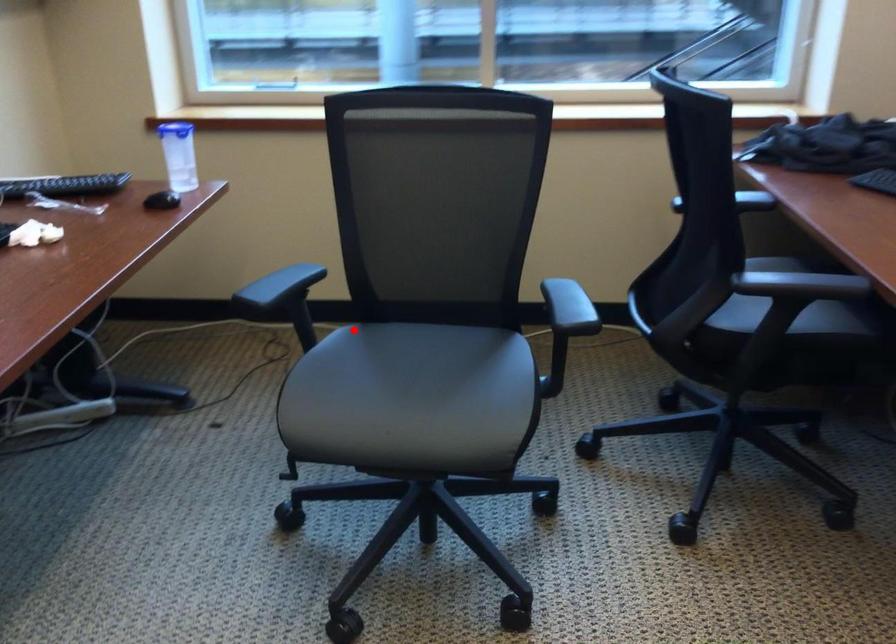
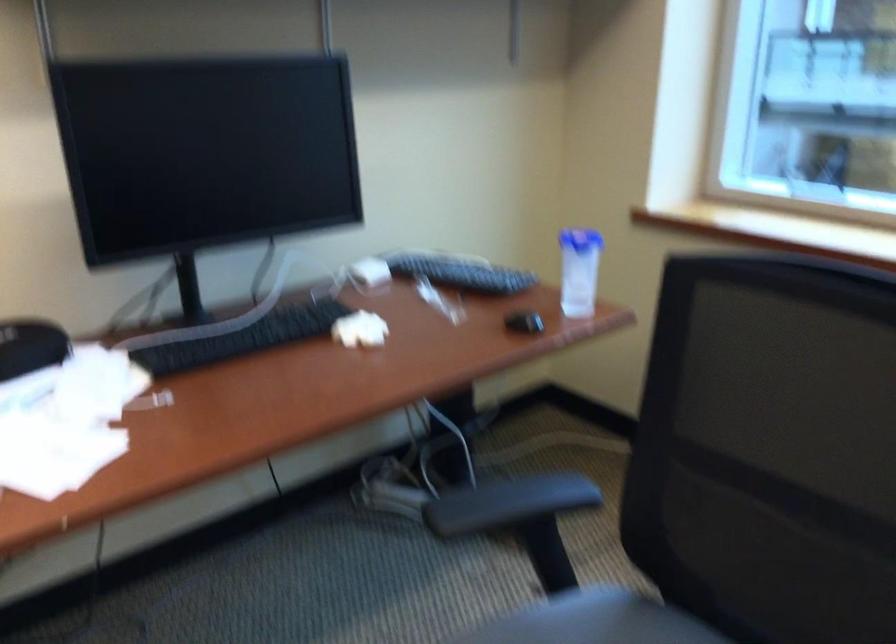
In the second image, find the point that corresponds to the highlighted location in the first image.

(593, 621)